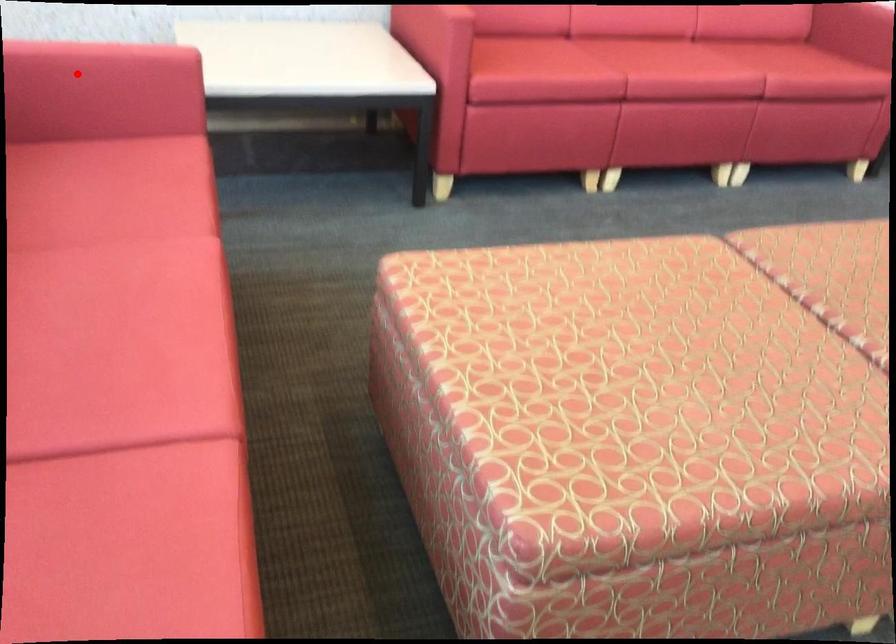
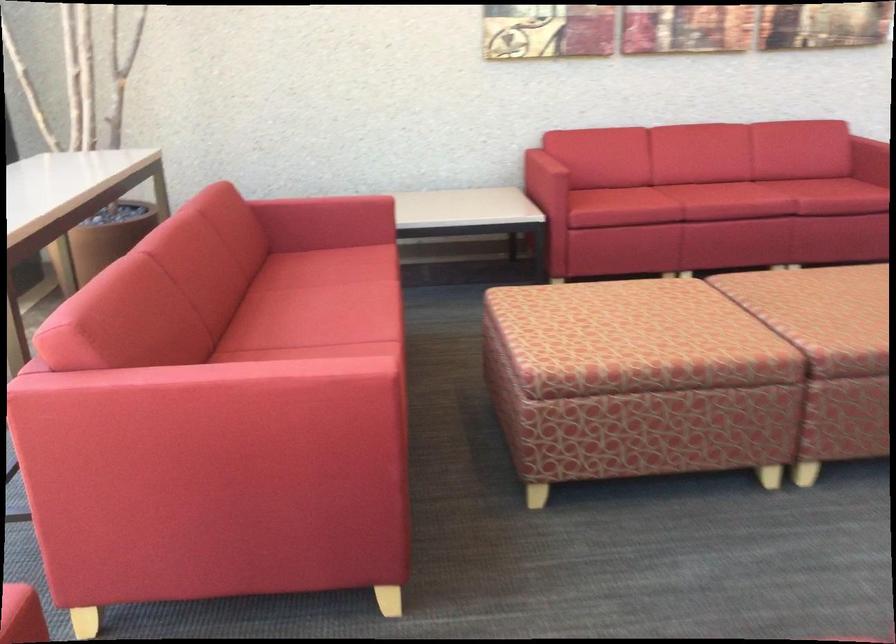
In the second image, find the point that corresponds to the highlighted location in the first image.

(326, 207)